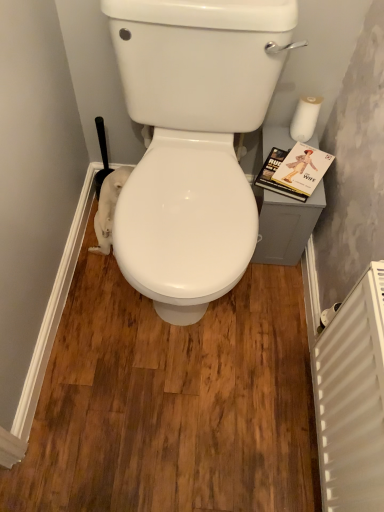
Question: Considering the relative sizes of white plastic radiator at lower right and hardcover book at right in the image provided, is white plastic radiator at lower right wider than hardcover book at right?

Choices:
 (A) yes
 (B) no

Answer: (B)

Question: Is white plastic radiator at lower right behind hardcover book at right?

Choices:
 (A) no
 (B) yes

Answer: (A)

Question: Would you say white plastic radiator at lower right is a long distance from hardcover book at right?

Choices:
 (A) no
 (B) yes

Answer: (A)

Question: Is white plastic radiator at lower right not inside hardcover book at right?

Choices:
 (A) yes
 (B) no

Answer: (A)

Question: Does white plastic radiator at lower right appear on the right side of hardcover book at right?

Choices:
 (A) yes
 (B) no

Answer: (A)

Question: Is hardcover book at right spatially inside white matte toilet paper at lower right, the 1th toilet paper when ordered from bottom to top, or outside of it?

Choices:
 (A) inside
 (B) outside

Answer: (B)

Question: Considering the positions of hardcover book at right and white matte toilet paper at lower right, the 1th toilet paper when ordered from bottom to top, in the image, is hardcover book at right taller or shorter than white matte toilet paper at lower right, the 1th toilet paper when ordered from bottom to top,?

Choices:
 (A) tall
 (B) short

Answer: (B)

Question: In the image, is hardcover book at right on the left side or the right side of white matte toilet paper at lower right, the 1th toilet paper in the left-to-right sequence?

Choices:
 (A) right
 (B) left

Answer: (A)

Question: In terms of width, does hardcover book at right look wider or thinner when compared to white matte toilet paper at lower right, the 1th toilet paper in the left-to-right sequence?

Choices:
 (A) wide
 (B) thin

Answer: (A)

Question: Considering the positions of white plastic radiator at lower right and white glossy toilet at center in the image, is white plastic radiator at lower right wider or thinner than white glossy toilet at center?

Choices:
 (A) thin
 (B) wide

Answer: (A)

Question: From the image's perspective, is white plastic radiator at lower right above or below white glossy toilet at center?

Choices:
 (A) above
 (B) below

Answer: (B)

Question: Looking at the image, does white plastic radiator at lower right seem bigger or smaller compared to white glossy toilet at center?

Choices:
 (A) small
 (B) big

Answer: (A)

Question: Is white plastic radiator at lower right situated inside white glossy toilet at center or outside?

Choices:
 (A) outside
 (B) inside

Answer: (A)

Question: Visually, is hardcover book at right positioned to the left or to the right of white matte toilet paper at upper right, which is counted as the second toilet paper, starting from the bottom?

Choices:
 (A) right
 (B) left

Answer: (B)

Question: Relative to white matte toilet paper at upper right, placed as the first toilet paper when sorted from top to bottom, is hardcover book at right in front or behind?

Choices:
 (A) front
 (B) behind

Answer: (A)